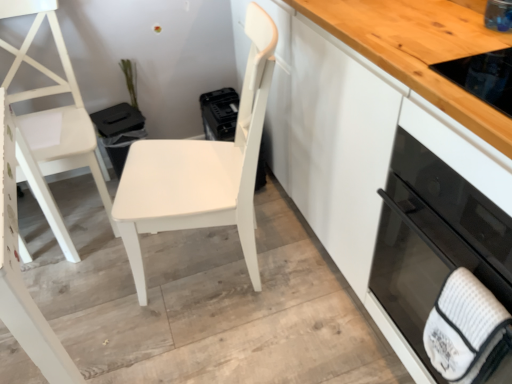
Locate an element on the screen. Image resolution: width=512 pixels, height=384 pixels. free space in front of white matte chair at left, which is the 2th chair in right-to-left order is located at coordinates [83, 278].